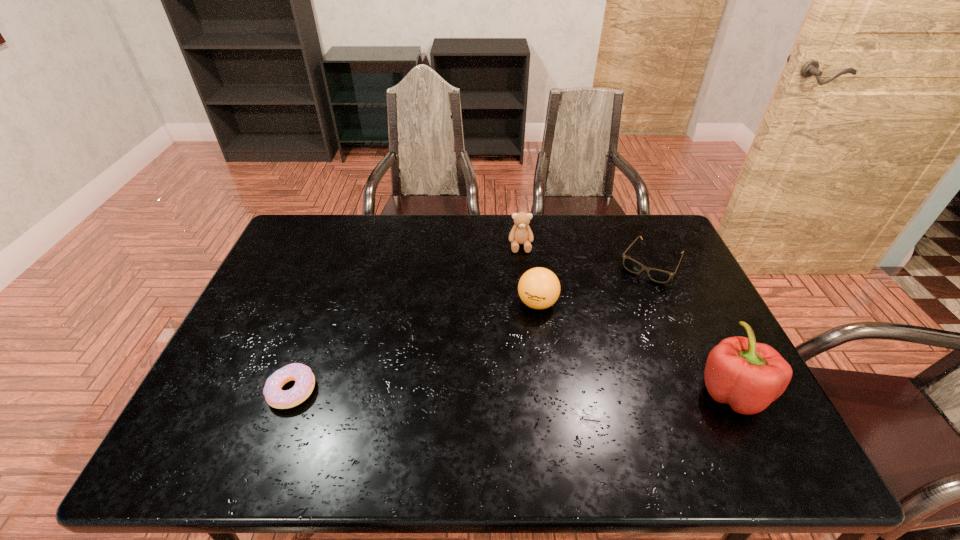
At what (x,y) coordinates should I click in order to perform the action: click on vacant region located 0.200m on the front-facing side of the teddy bear. Please return your answer as a coordinate pair (x, y). The width and height of the screenshot is (960, 540). Looking at the image, I should click on (525, 296).

The width and height of the screenshot is (960, 540). What are the coordinates of `vacant space positioned 0.100m on the front-facing side of the teddy bear` in the screenshot? It's located at (523, 274).

At what (x,y) coordinates should I click in order to perform the action: click on vacant space located 0.120m on the front-facing side of the teddy bear. Please return your answer as a coordinate pair (x, y). This screenshot has width=960, height=540. Looking at the image, I should click on (523, 278).

The image size is (960, 540). In order to click on free space located 0.400m on the side with brand of the third farthest object in this screenshot , I will do `click(427, 415)`.

Image resolution: width=960 pixels, height=540 pixels. What are the coordinates of `vacant space situated on the side with brand of the third farthest object` in the screenshot? It's located at pyautogui.click(x=437, y=406).

Where is `free location located on the side with brand of the third farthest object`? The width and height of the screenshot is (960, 540). free location located on the side with brand of the third farthest object is located at coordinates (492, 350).

This screenshot has width=960, height=540. Identify the location of sunglasses located at the far edge. (661, 276).

Image resolution: width=960 pixels, height=540 pixels. I want to click on teddy bear that is positioned at the far edge, so click(521, 233).

Locate an element on the screen. This screenshot has width=960, height=540. doughnut at the near edge is located at coordinates (304, 379).

Identify the location of bell pepper that is at the near edge. The height and width of the screenshot is (540, 960). (749, 376).